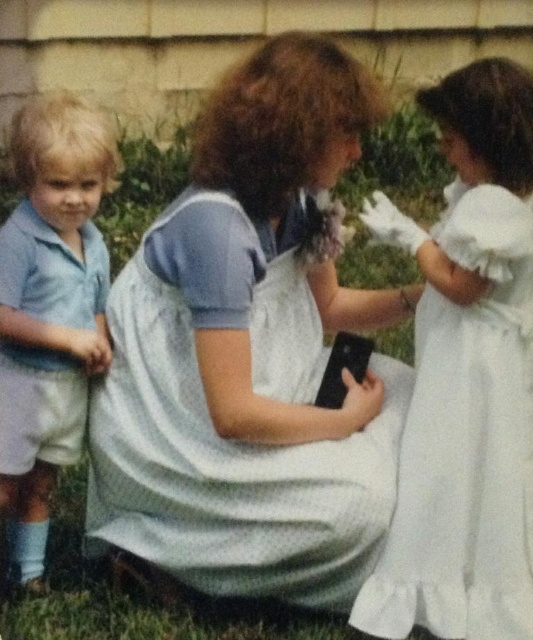
Question: Does white cotton dress at center have a larger size compared to white satin dress at right?

Choices:
 (A) yes
 (B) no

Answer: (A)

Question: Which point is closer to the camera taking this photo?

Choices:
 (A) (5, 353)
 (B) (237, 236)

Answer: (B)

Question: Which object appears farthest from the camera in this image?

Choices:
 (A) white satin dress at right
 (B) white cotton dress at center
 (C) matte blue shirt at left

Answer: (C)

Question: Can you confirm if white satin dress at right is positioned below matte blue shirt at left?

Choices:
 (A) yes
 (B) no

Answer: (A)

Question: Is white cotton dress at center below white satin dress at right?

Choices:
 (A) yes
 (B) no

Answer: (B)

Question: Which point is farther from the camera taking this photo?

Choices:
 (A) [294, 248]
 (B) [488, 516]
 (C) [36, 451]

Answer: (A)